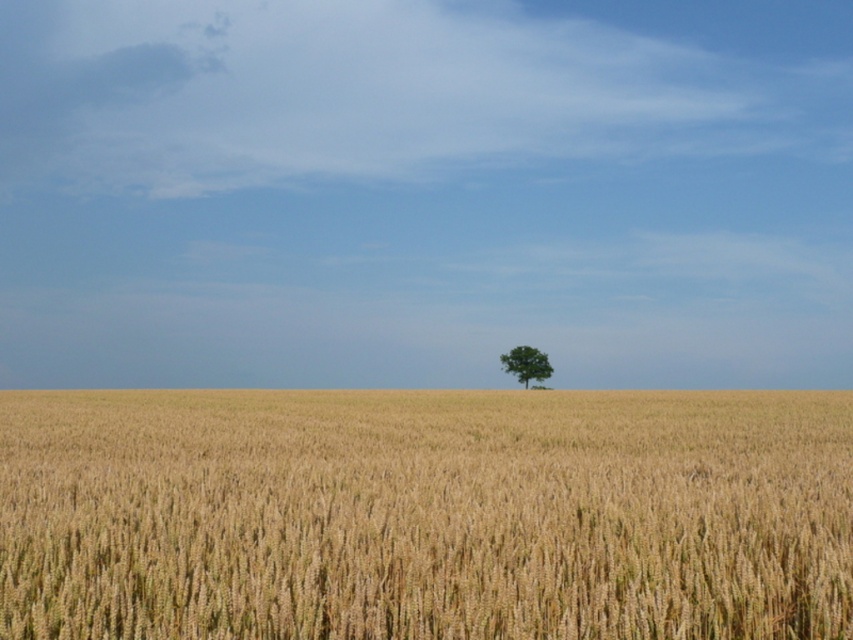
Question: Can you confirm if golden wheat field at center is positioned above green matte tree at center?

Choices:
 (A) yes
 (B) no

Answer: (A)

Question: Which point is closer to the camera taking this photo?

Choices:
 (A) (467, 432)
 (B) (502, 364)

Answer: (A)

Question: Among these points, which one is farthest from the camera?

Choices:
 (A) (512, 355)
 (B) (387, 620)

Answer: (A)

Question: From the image, what is the correct spatial relationship of golden wheat field at center in relation to green matte tree at center?

Choices:
 (A) left
 (B) right

Answer: (A)

Question: Is golden wheat field at center in front of green matte tree at center?

Choices:
 (A) no
 (B) yes

Answer: (B)